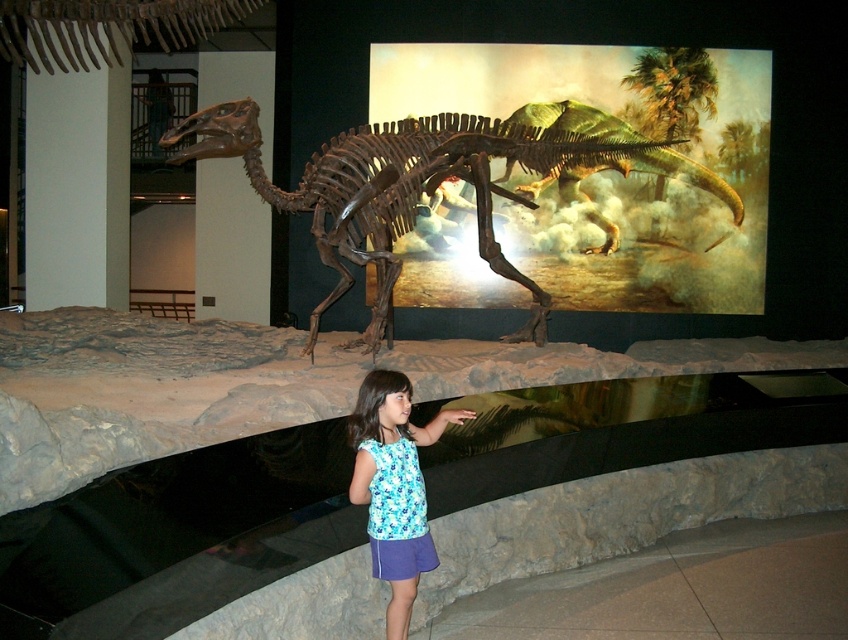
Question: Does brown bone at center lie in front of blue printed tank top at center?

Choices:
 (A) yes
 (B) no

Answer: (B)

Question: In this image, where is brown bone at center located relative to blue printed tank top at center?

Choices:
 (A) below
 (B) above

Answer: (B)

Question: Which point is closer to the camera?

Choices:
 (A) (382, 208)
 (B) (427, 552)

Answer: (B)

Question: Which of the following is the closest to the observer?

Choices:
 (A) brown bone at center
 (B) blue printed tank top at center

Answer: (B)

Question: Which point is closer to the camera?

Choices:
 (A) (243, 144)
 (B) (399, 444)

Answer: (B)

Question: Where is brown bone at center located in relation to blue printed tank top at center in the image?

Choices:
 (A) below
 (B) above

Answer: (B)